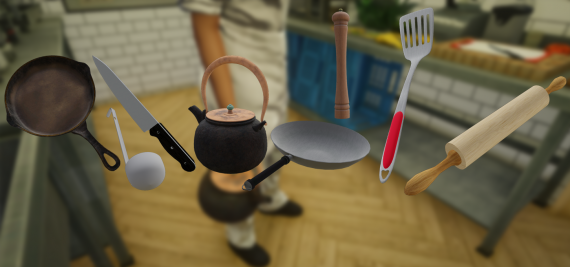
At what (x,y) coordinates should I click in order to perform the action: click on tile wall. Please return your answer as a coordinate pair (x, y). The image size is (570, 267). Looking at the image, I should click on point(158,35), point(458,95), point(545,12).